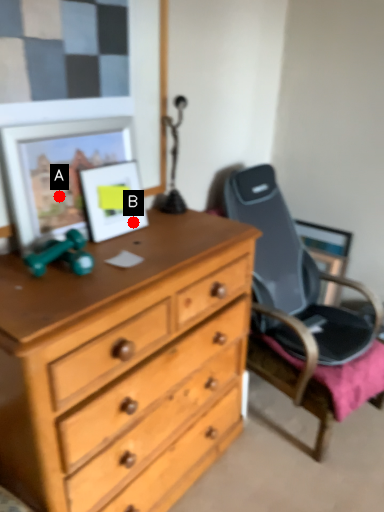
Question: Two points are circled on the image, labeled by A and B beside each circle. Which point is closer to the camera?

Choices:
 (A) A is closer
 (B) B is closer

Answer: (A)